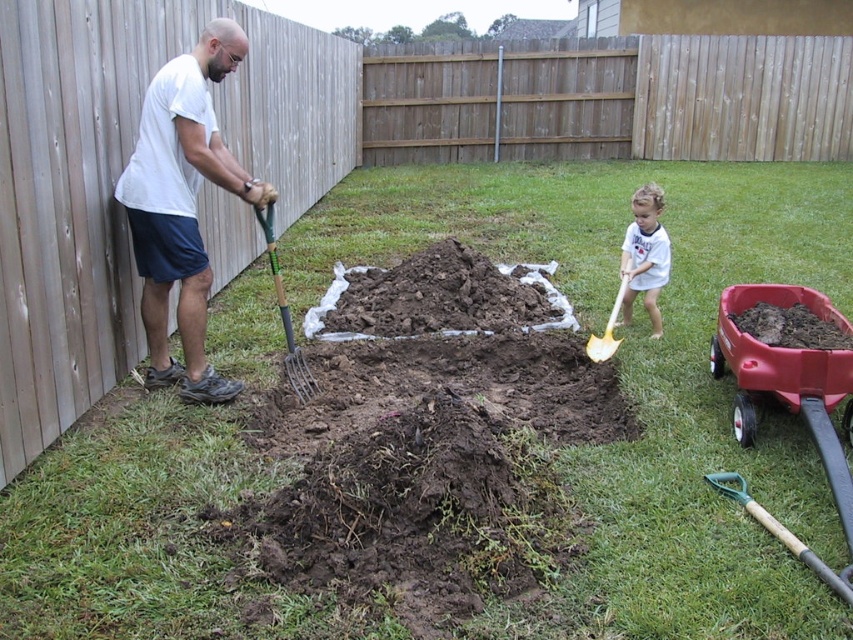
You are standing in the backyard and want to place a small garden gnome between the two points labeled as point (399, 332) and point (669, 243). Which point should you place the gnome closer to so it appears larger in the photo?

To make the garden gnome appear larger in the photo, place it closer to point (399, 332) because it is closer to the camera compared to point (669, 243).

You are a gardener who needs to move a wheelbarrow from the dark brown soil at center to the dark brown soil at lower right. Given that the wheelbarrow requires a minimum of 5 feet of space to maneuver, can you safely navigate the path between them?

The distance between the dark brown soil at center and dark brown soil at lower right is 6.23 feet, which exceeds the required 5 feet of space. Therefore, you can safely maneuver the wheelbarrow between them.